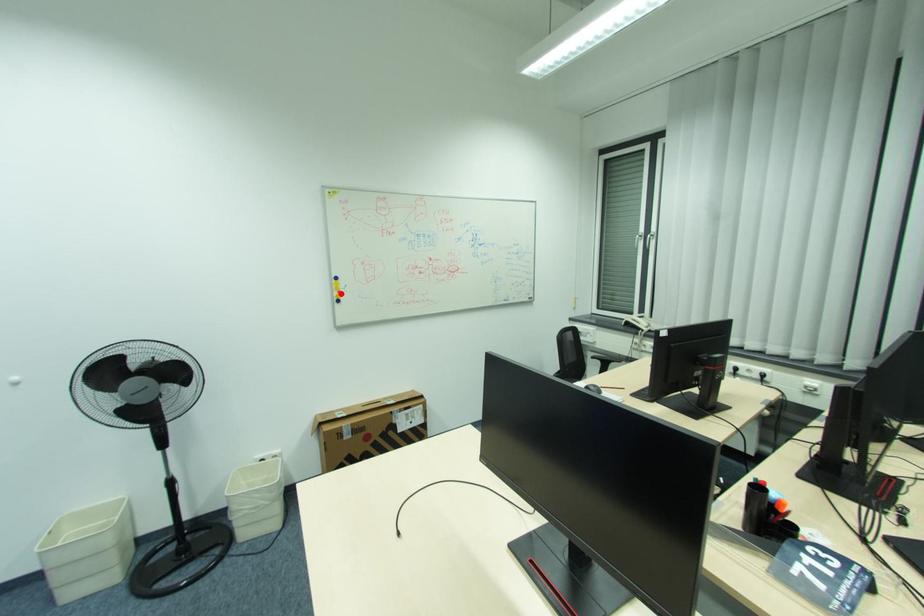
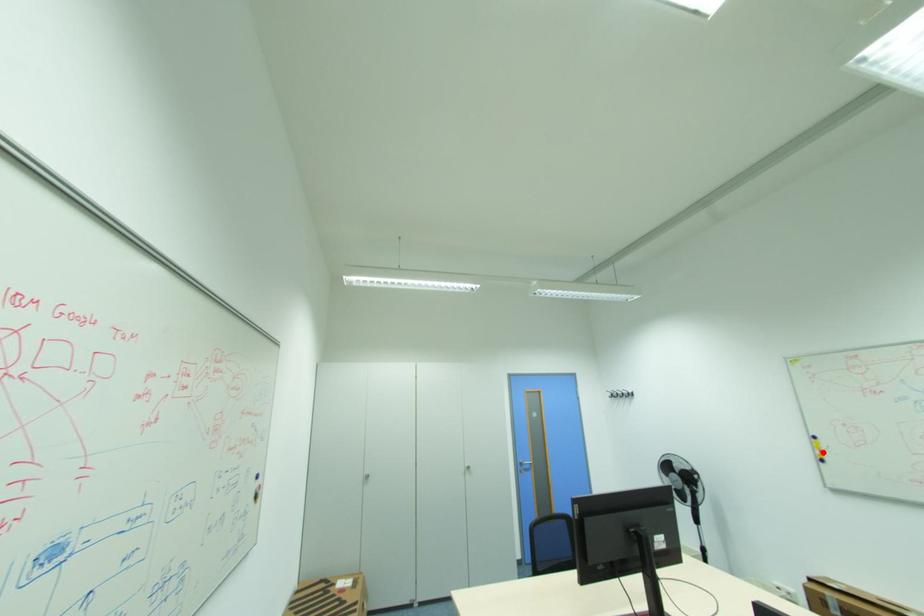
I am providing you with two images of the same scene from different viewpoints. A red point is marked on the first image and another point is marked on the second image. Are the points marked in image1 and image2 representing the same 3D position?

Yes